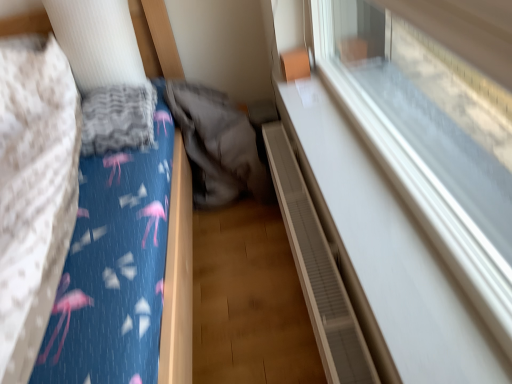
Question: From a real-world perspective, is blue cotton sheet at left over transparent glass window at upper right?

Choices:
 (A) yes
 (B) no

Answer: (B)

Question: Can you confirm if blue cotton sheet at left is smaller than transparent glass window at upper right?

Choices:
 (A) no
 (B) yes

Answer: (A)

Question: From a real-world perspective, is blue cotton sheet at left below transparent glass window at upper right?

Choices:
 (A) yes
 (B) no

Answer: (A)

Question: Can we say blue cotton sheet at left lies outside transparent glass window at upper right?

Choices:
 (A) yes
 (B) no

Answer: (A)

Question: Is blue cotton sheet at left to the left of transparent glass window at upper right from the viewer's perspective?

Choices:
 (A) yes
 (B) no

Answer: (A)

Question: Considering the relative sizes of blue cotton sheet at left and transparent glass window at upper right in the image provided, is blue cotton sheet at left taller than transparent glass window at upper right?

Choices:
 (A) yes
 (B) no

Answer: (B)

Question: Is transparent glass window at upper right to the left of blue fabric bed at left from the viewer's perspective?

Choices:
 (A) no
 (B) yes

Answer: (A)

Question: From a real-world perspective, is transparent glass window at upper right located higher than blue fabric bed at left?

Choices:
 (A) no
 (B) yes

Answer: (B)

Question: Can you confirm if transparent glass window at upper right is smaller than blue fabric bed at left?

Choices:
 (A) yes
 (B) no

Answer: (A)

Question: Can you confirm if transparent glass window at upper right is bigger than blue fabric bed at left?

Choices:
 (A) no
 (B) yes

Answer: (A)

Question: Is transparent glass window at upper right facing away from blue fabric bed at left?

Choices:
 (A) no
 (B) yes

Answer: (A)

Question: Could you tell me if transparent glass window at upper right is facing blue fabric bed at left?

Choices:
 (A) yes
 (B) no

Answer: (A)

Question: Does transparent glass window at upper right turn towards gray fabric sleeping bag at center?

Choices:
 (A) no
 (B) yes

Answer: (A)